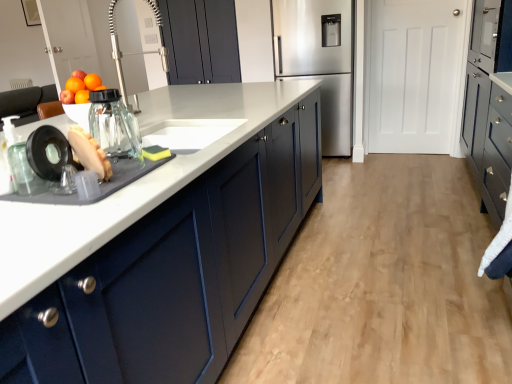
Question: Does matte blue cabinets at center lie in front of stainless steel refrigerator at center?

Choices:
 (A) no
 (B) yes

Answer: (B)

Question: Does matte blue cabinets at center come behind stainless steel refrigerator at center?

Choices:
 (A) yes
 (B) no

Answer: (B)

Question: From the image's perspective, is matte blue cabinets at center on top of stainless steel refrigerator at center?

Choices:
 (A) yes
 (B) no

Answer: (B)

Question: Is matte blue cabinets at center wider than stainless steel refrigerator at center?

Choices:
 (A) yes
 (B) no

Answer: (A)

Question: From a real-world perspective, is matte blue cabinets at center positioned under stainless steel refrigerator at center based on gravity?

Choices:
 (A) no
 (B) yes

Answer: (B)

Question: Is matte blue cabinets at center to the right of stainless steel refrigerator at center from the viewer's perspective?

Choices:
 (A) no
 (B) yes

Answer: (B)

Question: From the image's perspective, is yellow sponge at sink, acting as the second food starting from the left, below matte dark blue cabinet at upper center, the third cabinetry in the right-to-left sequence?

Choices:
 (A) no
 (B) yes

Answer: (B)

Question: From the image's perspective, is yellow sponge at sink, acting as the second food starting from the left, above matte dark blue cabinet at upper center, the third cabinetry in the right-to-left sequence?

Choices:
 (A) no
 (B) yes

Answer: (A)

Question: Is yellow sponge at sink, which is the 1th food from back to front, closer to the viewer compared to matte dark blue cabinet at upper center, the third cabinetry in the right-to-left sequence?

Choices:
 (A) no
 (B) yes

Answer: (B)

Question: Does yellow sponge at sink, the 2th food viewed from the front, appear on the right side of matte dark blue cabinet at upper center, the third cabinetry in the right-to-left sequence?

Choices:
 (A) no
 (B) yes

Answer: (B)

Question: Is yellow sponge at sink, which is the first food in right-to-left order, completely or partially outside of matte dark blue cabinet at upper center, acting as the first cabinetry starting from the left?

Choices:
 (A) yes
 (B) no

Answer: (A)

Question: Could you tell me if yellow sponge at sink, which is the 1th food from back to front, is facing matte dark blue cabinet at upper center, acting as the first cabinetry starting from the left?

Choices:
 (A) no
 (B) yes

Answer: (A)

Question: Is yellow sponge at sink, which is the first food in right-to-left order, aimed at clear glass jar at sink, the second appliance viewed from the front?

Choices:
 (A) yes
 (B) no

Answer: (B)